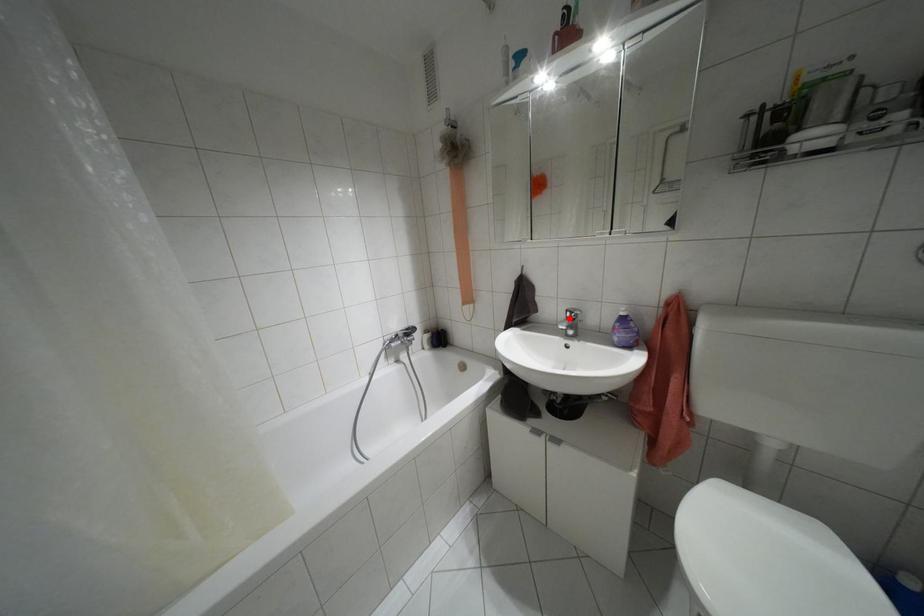
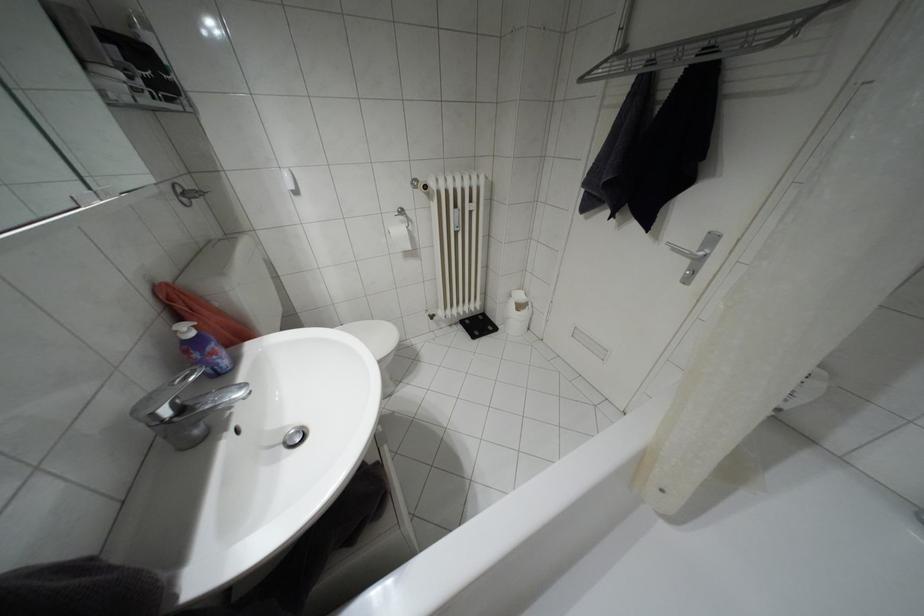
In the second image, find the point that corresponds to the highlighted location in the first image.

(180, 408)